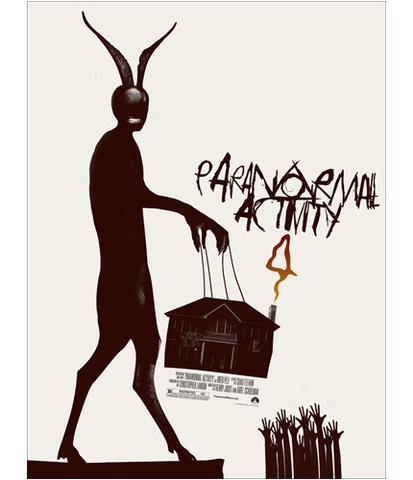
This screenshot has width=413, height=480. Identify the location of chimney. (273, 311).